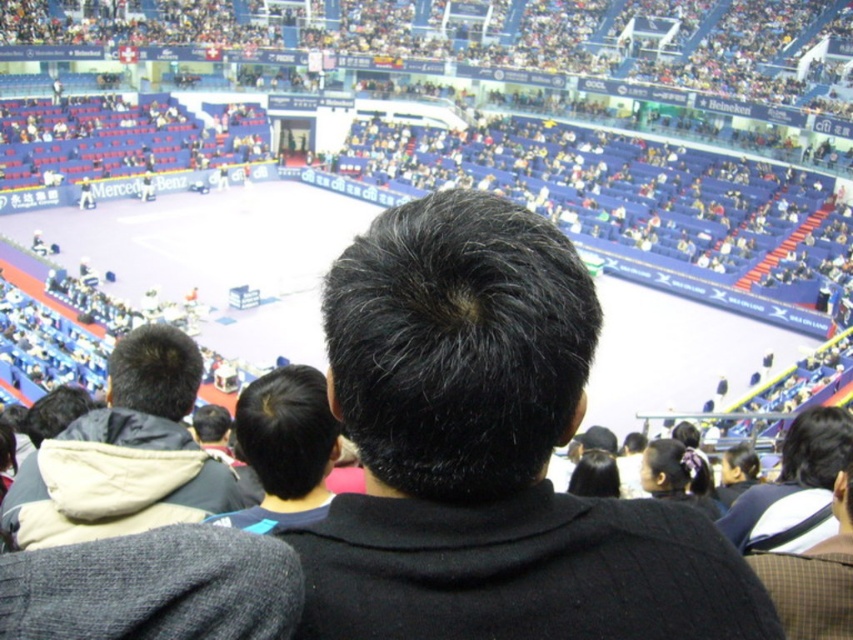
Question: Can you confirm if dark gray jacket at center is positioned below dark brown hair at center?

Choices:
 (A) yes
 (B) no

Answer: (B)

Question: Observing the image, what is the correct spatial positioning of black matte hair at center in reference to dark gray jacket at center?

Choices:
 (A) left
 (B) right

Answer: (B)

Question: Which point appears farthest from the camera in this image?

Choices:
 (A) (399, 500)
 (B) (45, 460)

Answer: (B)

Question: Which point is farther to the camera?

Choices:
 (A) (305, 404)
 (B) (426, 388)

Answer: (A)

Question: Which point is farther to the camera?

Choices:
 (A) (676, 515)
 (B) (44, 444)

Answer: (B)

Question: Can you confirm if black matte hair at center is thinner than dark brown hair at center?

Choices:
 (A) yes
 (B) no

Answer: (B)